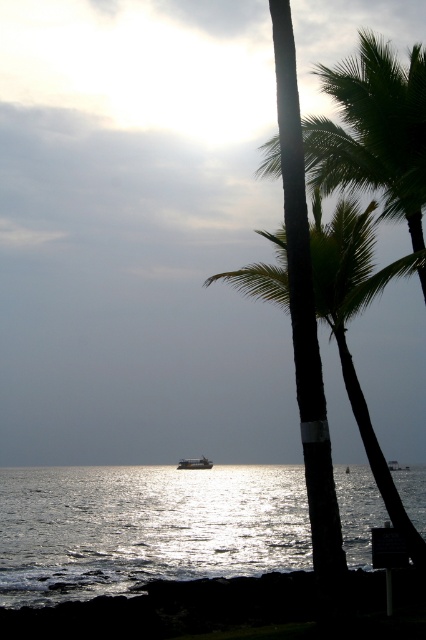
Question: Estimate the real-world distances between objects in this image. Which object is closer to the shiny reflective water at center?

Choices:
 (A) green leafy palm tree at upper right
 (B) metallic silver boat at center
 (C) black smooth palm tree at center

Answer: (B)

Question: Can you confirm if green leafy palm tree at upper right is bigger than black smooth palm tree at center?

Choices:
 (A) yes
 (B) no

Answer: (A)

Question: Which point is closer to the camera taking this photo?

Choices:
 (A) (402, 168)
 (B) (287, 570)

Answer: (A)

Question: Which object appears closest to the camera in this image?

Choices:
 (A) metallic silver boat at center
 (B) shiny reflective water at center

Answer: (B)

Question: Is green leafy palm tree at upper right to the right of metallic silver boat at center from the viewer's perspective?

Choices:
 (A) yes
 (B) no

Answer: (A)

Question: Can you confirm if shiny reflective water at center is positioned below black smooth palm tree at center?

Choices:
 (A) yes
 (B) no

Answer: (A)